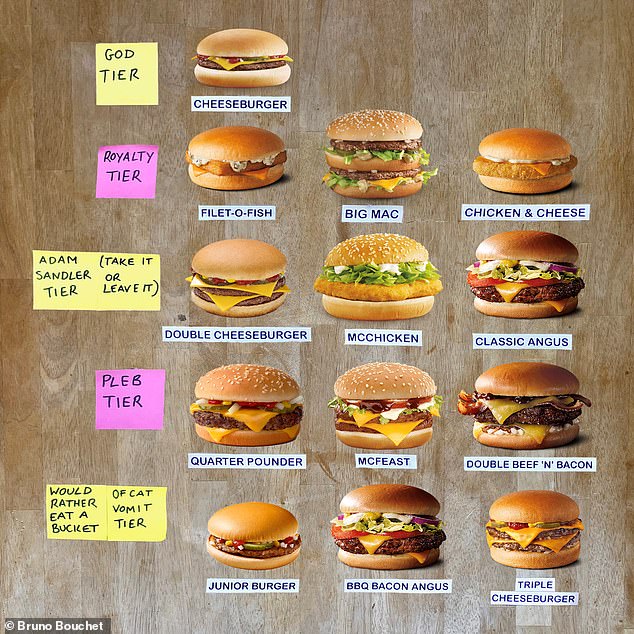
The height and width of the screenshot is (634, 634). What are the coordinates of `sticky notes` in the screenshot? It's located at point(117,512), point(67,505), point(131,396), point(94,292), point(127,274), point(126,63), point(127,178).